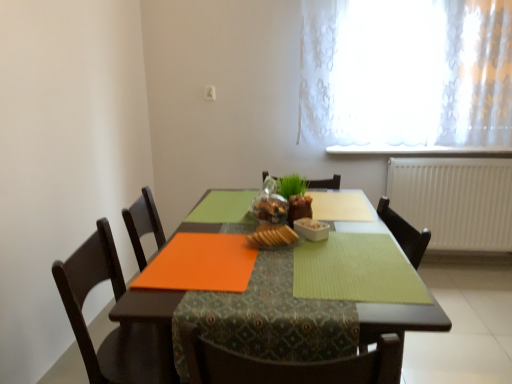
Question: Considering the positions of green textured placemat at center, which ranks as the first place mat in right-to-left order, and orange matte placemat at center, the second place mat in the right-to-left sequence, in the image, is green textured placemat at center, which ranks as the first place mat in right-to-left order, wider or thinner than orange matte placemat at center, the second place mat in the right-to-left sequence,?

Choices:
 (A) thin
 (B) wide

Answer: (B)

Question: From a real-world perspective, is green textured placemat at center, the 2th place mat viewed from the left, above or below orange matte placemat at center, the second place mat in the right-to-left sequence?

Choices:
 (A) above
 (B) below

Answer: (A)

Question: Which is nearer to the translucent fabric at upper right?

Choices:
 (A) white plastic radiator at right
 (B) slightly toasted bread at center
 (C) orange matte placemat at center
 (D) green textured placemat at center, which ranks as the first place mat in right-to-left order
 (E) dark wood chair at lower left

Answer: (A)

Question: Considering the real-world distances, which object is farthest from the green textured placemat at center, which ranks as the first place mat in right-to-left order?

Choices:
 (A) orange matte placemat at center
 (B) slightly toasted bread at center
 (C) white glossy bowl at center
 (D) orange matte placemat at center, which is counted as the first place mat, starting from the left
 (E) white plastic radiator at right

Answer: (E)